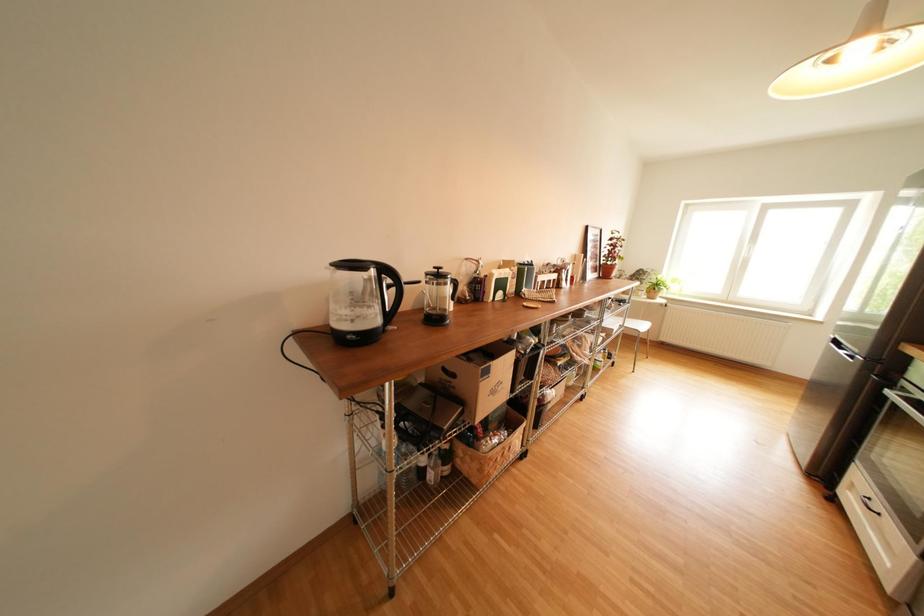
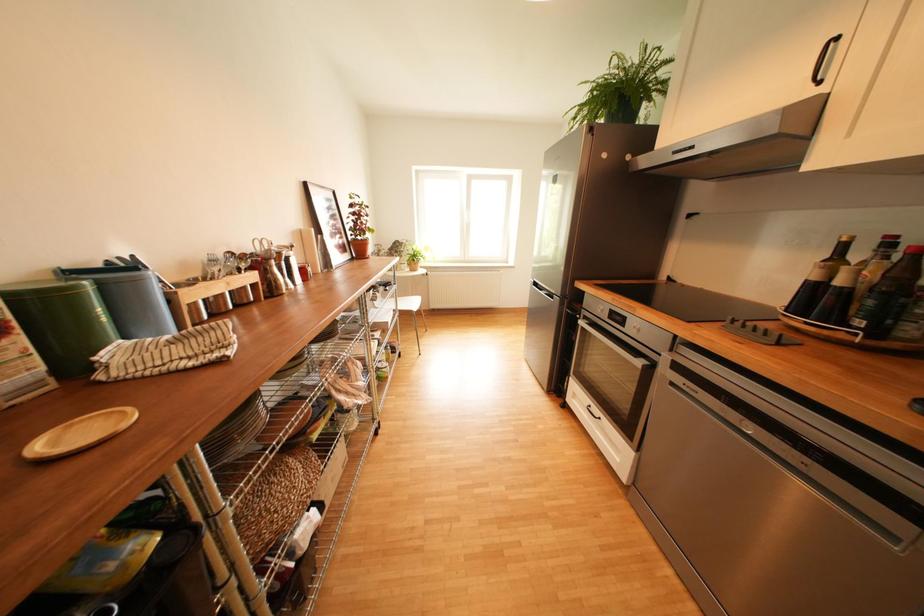
Question: The camera is either moving clockwise (left) or counter-clockwise (right) around the object. The first image is from the beginning of the video and the second image is from the end. Is the camera moving left or right when shooting the video?

Choices:
 (A) Left
 (B) Right

Answer: (A)